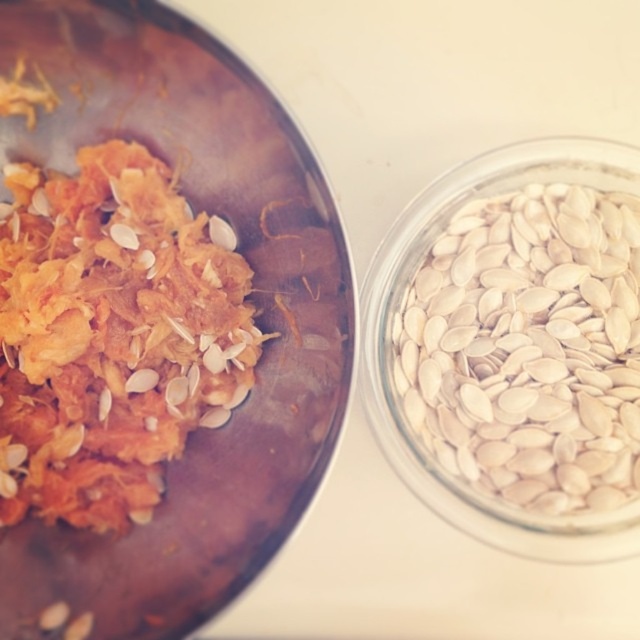
From the picture: Between orange shredded food at left and white smooth pumpkin seeds at right, which one has more height?

With more height is orange shredded food at left.

Is point (49, 387) farther from camera compared to point (580, 305)?

No, (49, 387) is in front of (580, 305).

This screenshot has width=640, height=640. What are the coordinates of `orange shredded food at left` in the screenshot? It's located at (109, 337).